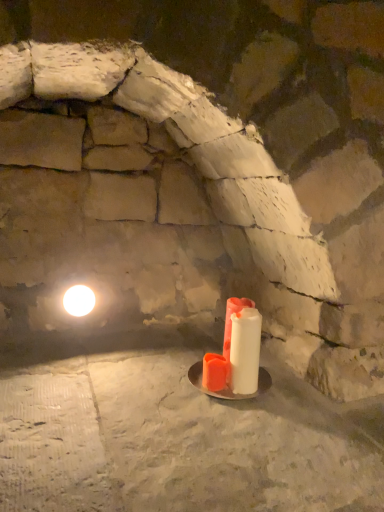
Question: In the image, is white matte candle at center positioned in front of or behind white glossy light at upper left?

Choices:
 (A) front
 (B) behind

Answer: (A)

Question: Considering the positions of point (253, 336) and point (82, 298), is point (253, 336) closer or farther from the camera than point (82, 298)?

Choices:
 (A) closer
 (B) farther

Answer: (A)

Question: From the image's perspective, relative to white glossy light at upper left, is white matte candle at center above or below?

Choices:
 (A) above
 (B) below

Answer: (B)

Question: Relative to white matte candle at center, is white glossy light at upper left in front or behind?

Choices:
 (A) front
 (B) behind

Answer: (B)

Question: Is point (94, 298) closer or farther from the camera than point (241, 345)?

Choices:
 (A) farther
 (B) closer

Answer: (A)

Question: From a real-world perspective, is white glossy light at upper left above or below white matte candle at center?

Choices:
 (A) above
 (B) below

Answer: (A)

Question: Based on their positions, is white glossy light at upper left located to the left or right of white matte candle at center?

Choices:
 (A) right
 (B) left

Answer: (B)